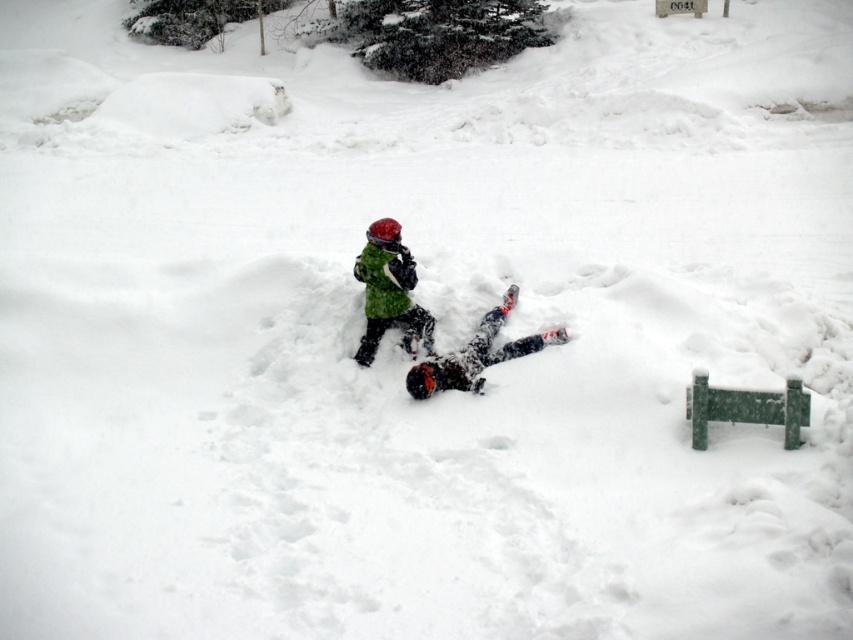
You are trying to decide which of the two green items in the scene is larger in width. You see the green snowsuit at center and the green fuzzy jacket at center. Based on the scene, which one is wider?

The green snowsuit at center is wider than the green fuzzy jacket at center according to the description.

You are a drone operator trying to capture a photo of the green snowsuit at center. The drone has a camera with a very narrow field of view. You need to input the exact coordinates to focus on. What coordinates should you input?

You should input the coordinates at point (389,291) to focus on the green snowsuit at center.

You are standing in the snowy scene and want to place a small flag exactly halfway between the two points, point (402,320) and point (413,285). Which direction should you move from the closer point to reach the halfway point?

The halfway point between point (402,320) and point (413,285) would be at coordinates 0.474, 0.479. Since point (413,285) is closer to the halfway point, you should move towards the direction of point (402,320) from point (413,285) to reach the halfway point.